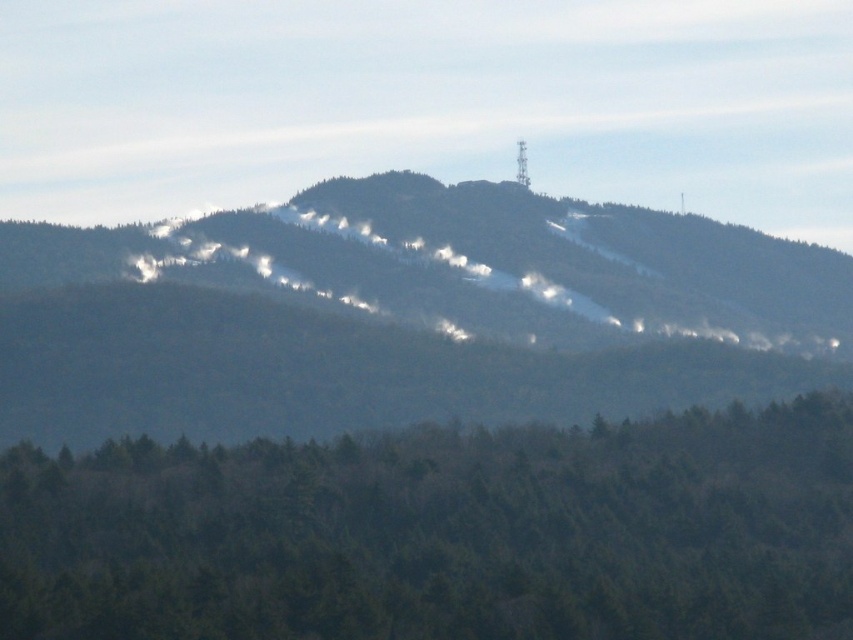
Consider the image. You are a hiker planning to climb the snowy forested mountain at center. From your current position at the base of the green matte trees at lower center, which direction should you head to start your ascent?

The snowy forested mountain at center is positioned over the green matte trees at lower center, so you should head towards the center from the green matte trees at lower center to begin your ascent.

You are an environmental scientist assessing the landscape. You need to determine which object occupies a larger area in the image. Based on the scene, which one is bigger between the snowy forested mountain at center and the green matte trees at lower center?

The snowy forested mountain at center is bigger than the green matte trees at lower center according to the description.